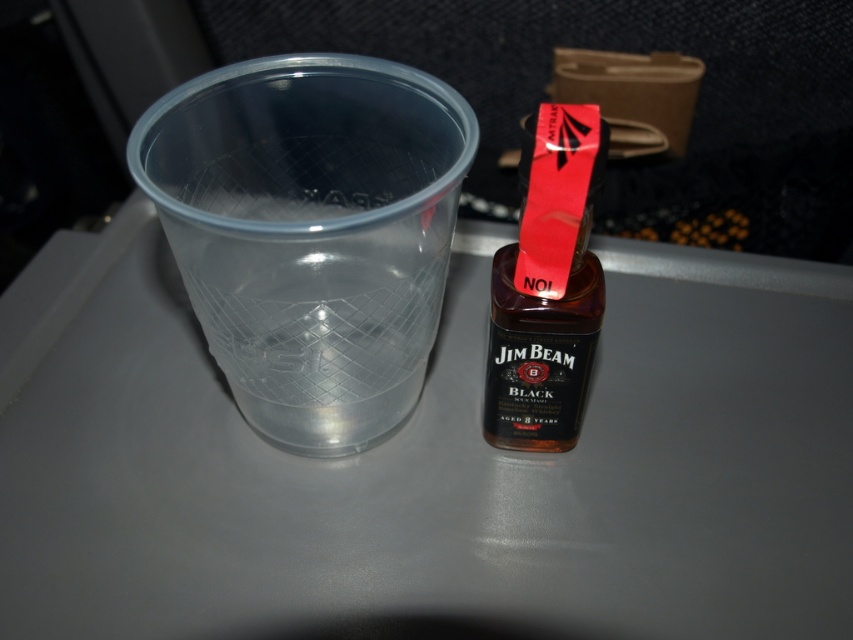
Question: Which of the following is the farthest from the observer?

Choices:
 (A) transparent plastic cup at left
 (B) black glass jim beam bottle at center

Answer: (B)

Question: Which of the following is the farthest from the observer?

Choices:
 (A) (532, 292)
 (B) (224, 339)

Answer: (B)

Question: Does transparent plastic cup at left have a larger size compared to black glass jim beam bottle at center?

Choices:
 (A) no
 (B) yes

Answer: (B)

Question: Does transparent plastic cup at left appear over black glass jim beam bottle at center?

Choices:
 (A) no
 (B) yes

Answer: (B)

Question: Can you confirm if transparent plastic cup at left is thinner than black glass jim beam bottle at center?

Choices:
 (A) yes
 (B) no

Answer: (B)